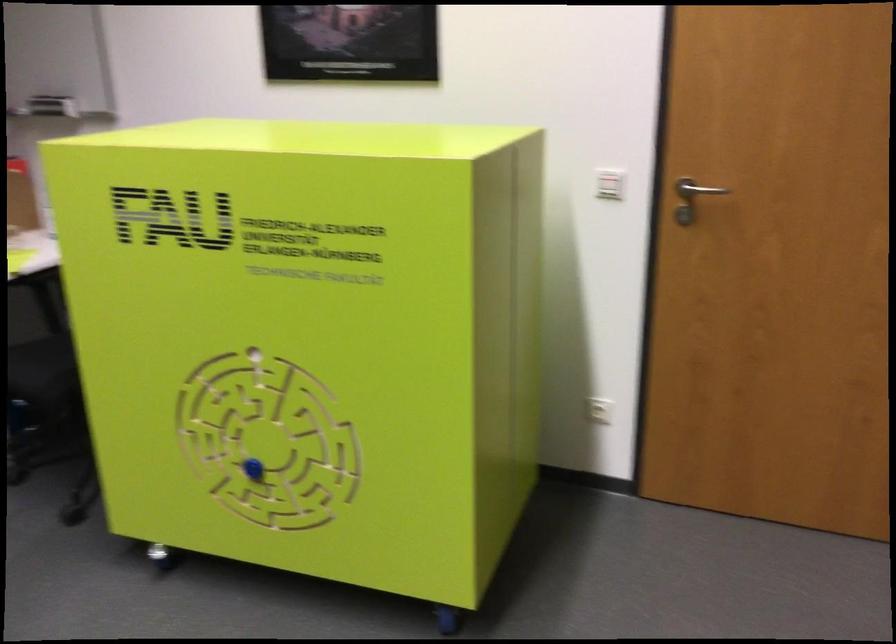
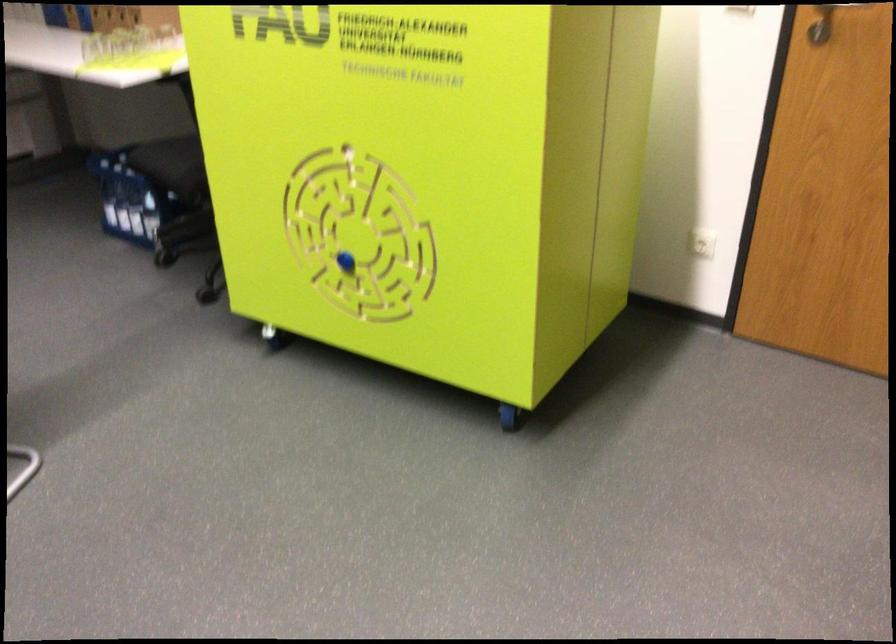
Where in the second image is the point corresponding to [606,406] from the first image?

(702, 243)